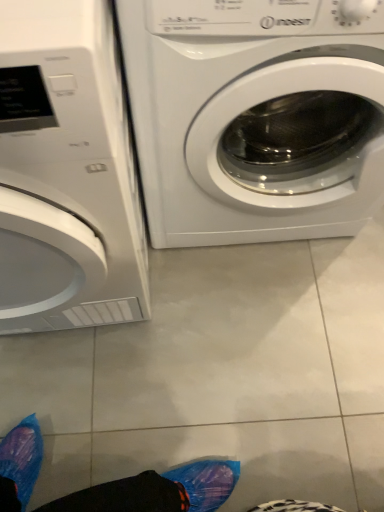
Question: Is white glossy washing machine at left, the first washing machine in the left-to-right sequence, in front of or behind white glossy washing machine at center, the 2th washing machine in the left-to-right sequence, in the image?

Choices:
 (A) behind
 (B) front

Answer: (B)

Question: Would you say white glossy washing machine at left, which ranks as the 2th washing machine in right-to-left order, is inside or outside white glossy washing machine at center, the 2th washing machine in the left-to-right sequence?

Choices:
 (A) outside
 (B) inside

Answer: (A)

Question: Does point (79, 231) appear closer or farther from the camera than point (221, 53)?

Choices:
 (A) closer
 (B) farther

Answer: (B)

Question: Based on their sizes in the image, would you say white glossy washing machine at center, the 2th washing machine in the left-to-right sequence, is bigger or smaller than white glossy washing machine at left, the first washing machine in the left-to-right sequence?

Choices:
 (A) small
 (B) big

Answer: (A)

Question: From the image's perspective, relative to white glossy washing machine at left, which ranks as the 2th washing machine in right-to-left order, is white glossy washing machine at center, the 1th washing machine positioned from the right, above or below?

Choices:
 (A) below
 (B) above

Answer: (B)

Question: In terms of width, does white glossy washing machine at center, the 1th washing machine positioned from the right, look wider or thinner when compared to white glossy washing machine at left, the first washing machine in the left-to-right sequence?

Choices:
 (A) thin
 (B) wide

Answer: (A)

Question: Considering the positions of point (316, 136) and point (4, 39), is point (316, 136) closer or farther from the camera than point (4, 39)?

Choices:
 (A) closer
 (B) farther

Answer: (B)